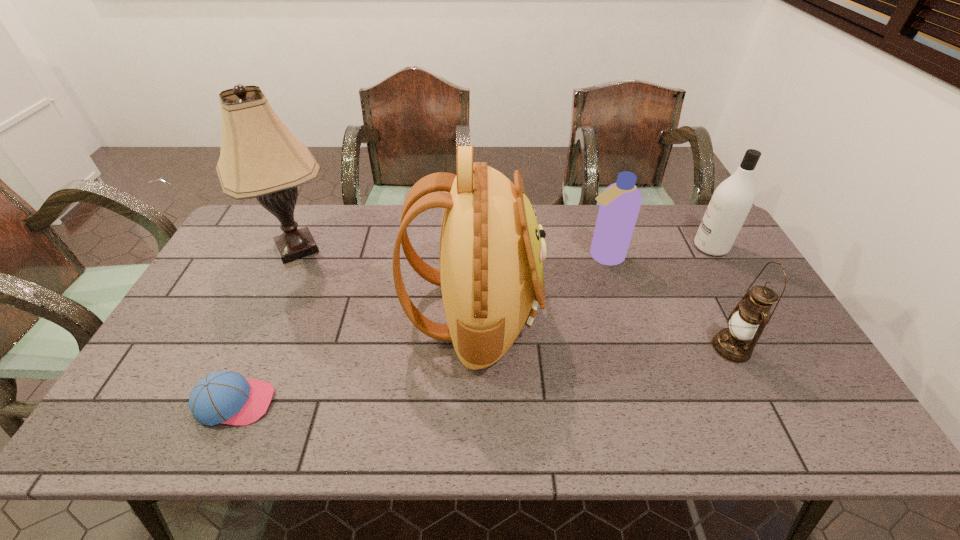
This screenshot has width=960, height=540. What are the coordinates of `vacant region that satisfies the following two spatial constraints: 1. on the front side of the left shampoo; 2. on the front-facing side of the baseball cap` in the screenshot? It's located at (647, 403).